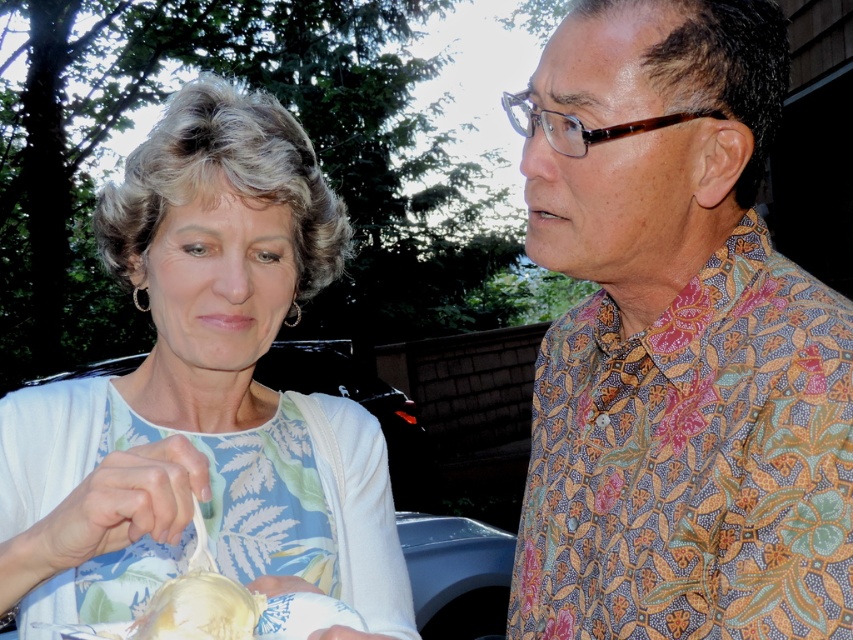
You are standing in front of the scene and want to know which of the two points, point (846, 563) or point (190, 582), is closer to you. Can you determine this based on their positions?

Point (846, 563) is further to the viewer than point (190, 582), so point (190, 582) is closer to you.